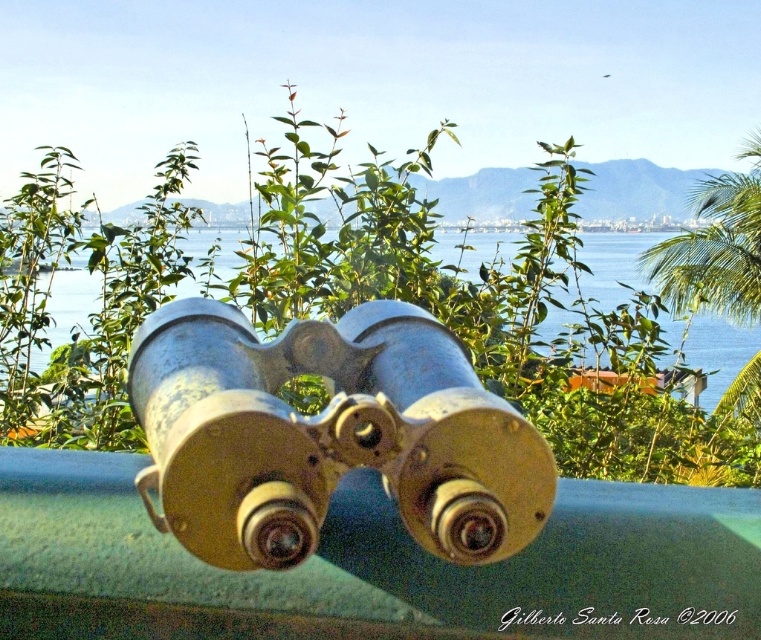
Consider the image. Between gold metallic binoculars at center and green leafy palm tree at upper right, which one has more height?

green leafy palm tree at upper right

Which is more to the left, gold metallic binoculars at center or green leafy palm tree at upper right?

Positioned to the left is gold metallic binoculars at center.

Who is more distant from viewer, (266,525) or (747,320)?

The point (747,320) is more distant.

Where is `gold metallic binoculars at center`? gold metallic binoculars at center is located at coordinates (328, 435).

Is gold metallic binoculars at center closer to the viewer compared to metallic water at center?

Yes.

Does gold metallic binoculars at center appear on the left side of metallic water at center?

Correct, you'll find gold metallic binoculars at center to the left of metallic water at center.

Identify the location of gold metallic binoculars at center. The height and width of the screenshot is (640, 761). (328, 435).

Is point (728, 294) positioned before point (613, 304)?

No, (728, 294) is behind (613, 304).

Who is shorter, green leafy palm tree at upper right or metallic water at center?

With less height is metallic water at center.

The height and width of the screenshot is (640, 761). I want to click on green leafy palm tree at upper right, so click(x=715, y=248).